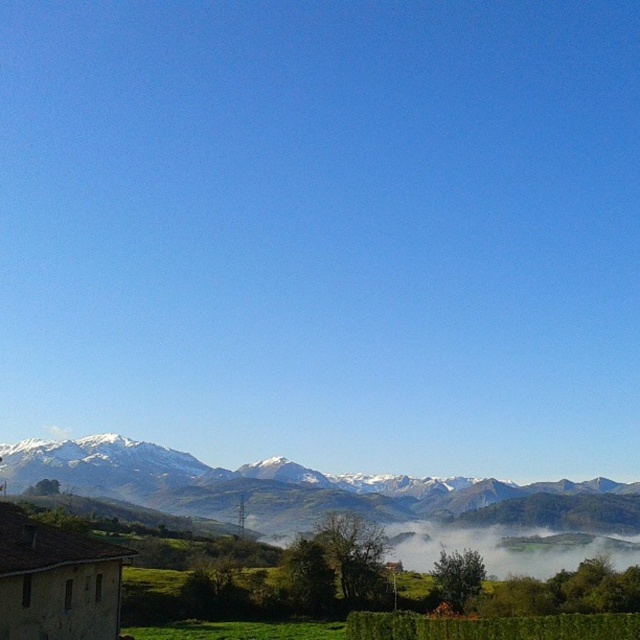
Question: Can you confirm if snowy rocky mountain range at upper center is smaller than white misty fog at lower center?

Choices:
 (A) no
 (B) yes

Answer: (A)

Question: Which point is closer to the camera?

Choices:
 (A) (198, 509)
 (B) (486, 573)

Answer: (B)

Question: Can you confirm if snowy rocky mountain range at upper center is positioned above white misty fog at lower center?

Choices:
 (A) no
 (B) yes

Answer: (A)

Question: Which point appears closest to the camera in this image?

Choices:
 (A) 248,488
 (B) 388,548

Answer: (B)

Question: Among these points, which one is farthest from the camera?

Choices:
 (A) (609, 563)
 (B) (116, 470)

Answer: (B)

Question: Does snowy rocky mountain range at upper center have a larger size compared to white misty fog at lower center?

Choices:
 (A) no
 (B) yes

Answer: (B)